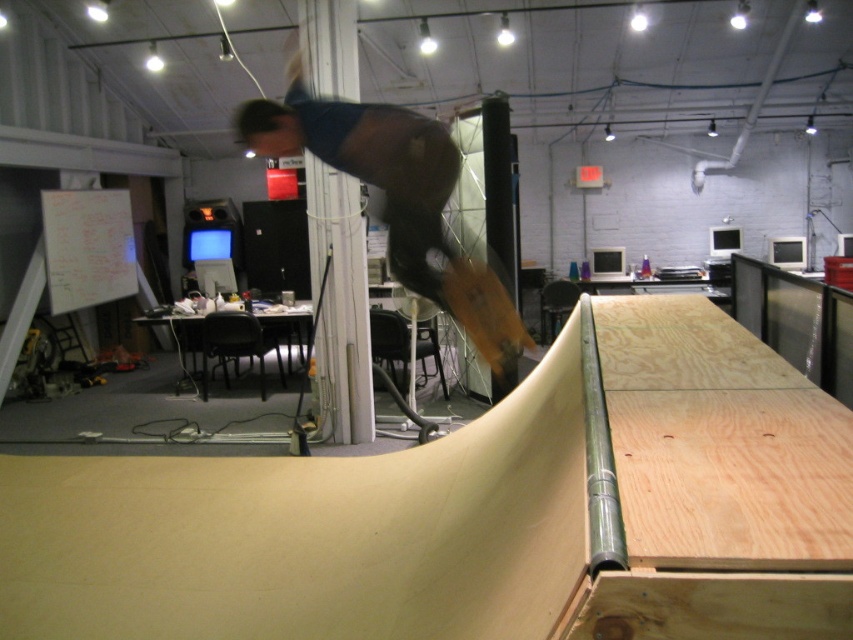
Question: Among these points, which one is nearest to the camera?

Choices:
 (A) (410, 176)
 (B) (503, 358)

Answer: (A)

Question: Is brown leather jacket at center bigger than wooden skateboard at center?

Choices:
 (A) yes
 (B) no

Answer: (A)

Question: Is the position of brown leather jacket at center more distant than that of wooden skateboard at center?

Choices:
 (A) no
 (B) yes

Answer: (A)

Question: Does brown leather jacket at center come in front of wooden skateboard at center?

Choices:
 (A) yes
 (B) no

Answer: (A)